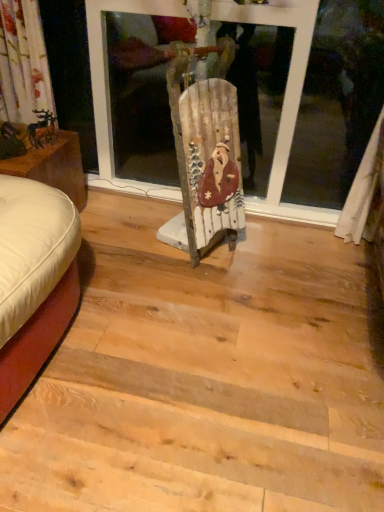
Identify the location of unoccupied space behind metallic gold reindeer at left. (43, 130).